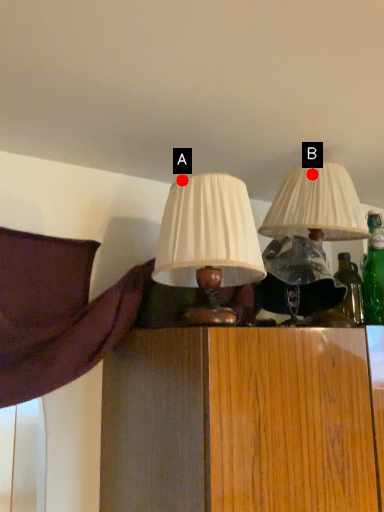
Question: Two points are circled on the image, labeled by A and B beside each circle. Which of the following is the farthest from the observer?

Choices:
 (A) A is further
 (B) B is further

Answer: (B)